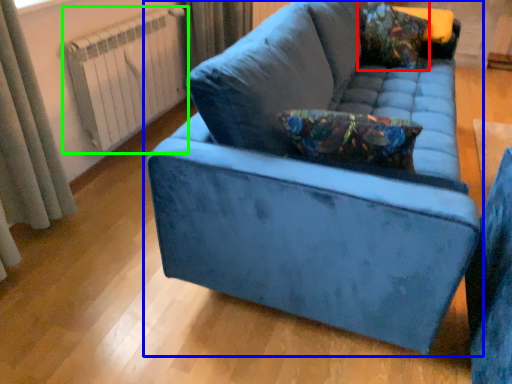
Question: Which object is positioned closest to throw pillow (highlighted by a red box)? Select from studio couch (highlighted by a blue box) and radiator (highlighted by a green box).

Choices:
 (A) studio couch
 (B) radiator

Answer: (A)